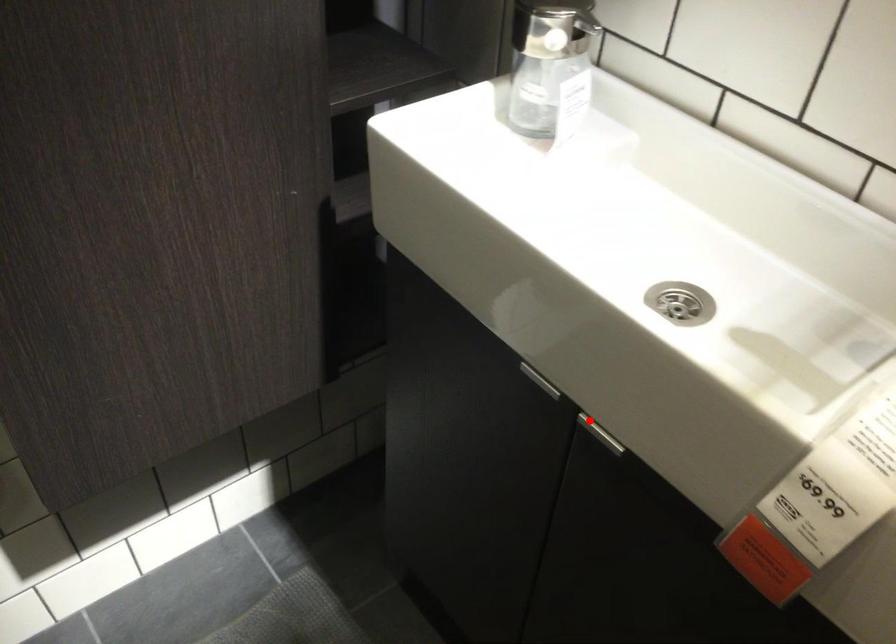
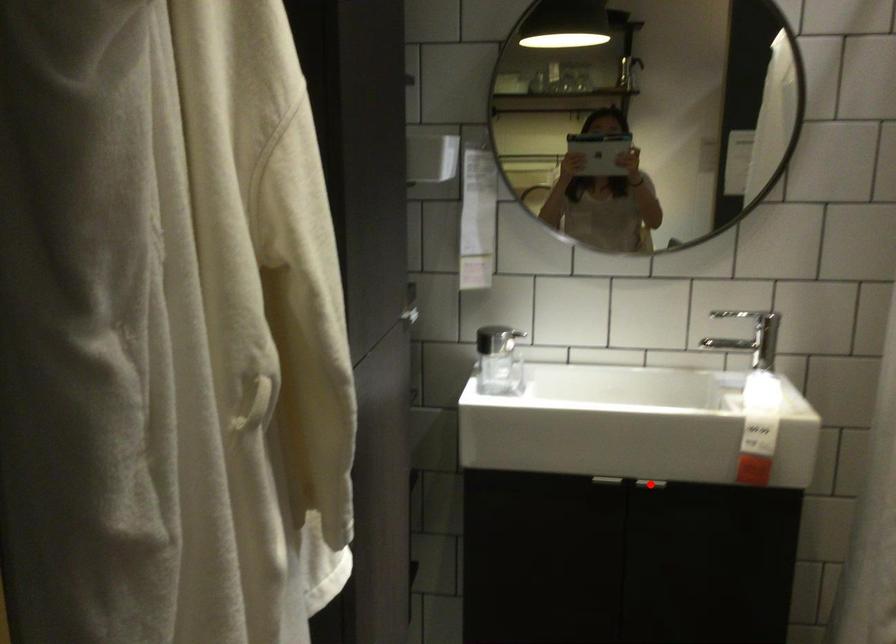
From the picture: I am providing you with two images of the same scene from different viewpoints. A red point is marked on the first image and another point is marked on the second image. Is the marked point in image1 the same physical position as the marked point in image2?

Yes